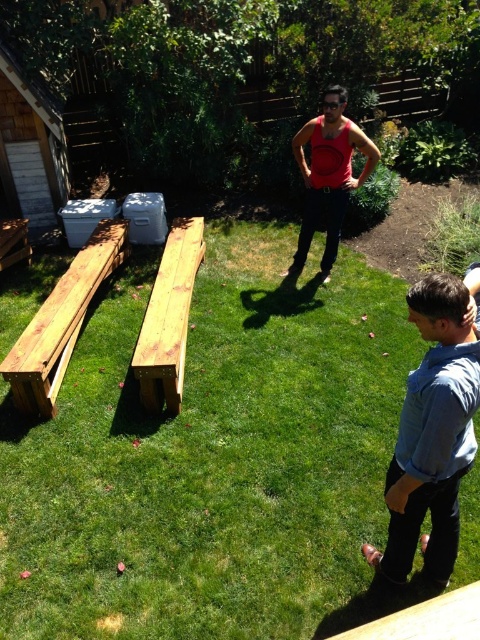
Consider the image. Is blue denim shirt at lower right wider than matte red tank top at center?

In fact, blue denim shirt at lower right might be narrower than matte red tank top at center.

Is point (442, 282) positioned behind point (351, 144)?

No, (442, 282) is in front of (351, 144).

Who is more distant from viewer, (389, 545) or (331, 154)?

Positioned behind is point (331, 154).

In order to click on blue denim shirt at lower right in this screenshot , I will do `click(432, 433)`.

Between natural wood bench at left and natural wood bench at center, which one has less height?

With less height is natural wood bench at left.

Does natural wood bench at left appear on the right side of natural wood bench at center?

Incorrect, natural wood bench at left is not on the right side of natural wood bench at center.

Describe the element at coordinates (60, 323) in the screenshot. Image resolution: width=480 pixels, height=640 pixels. I see `natural wood bench at left` at that location.

This screenshot has height=640, width=480. In order to click on natural wood bench at left in this screenshot , I will do `click(60, 323)`.

What do you see at coordinates (60, 323) in the screenshot?
I see `natural wood bench at left` at bounding box center [60, 323].

Locate an element on the screen. natural wood bench at left is located at coordinates (60, 323).